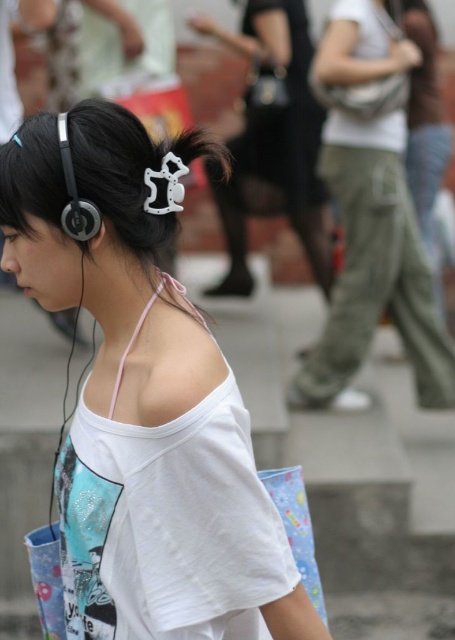
You are an artist trying to sketch the scene. The black plastic hair clip at upper center is positioned at coordinates 0.239, 0.429. If you want to draw it accurately, where should you place it on your canvas?

The black plastic hair clip at upper center should be placed at coordinates [195,152] on the canvas to accurately reflect its position in the scene.

The person in the image is wearing a black plastic hair clip at upper center and has a matte black earphone at upper left. Which of these two items is bigger?

The black plastic hair clip at upper center is larger in size than the matte black earphone at upper left.